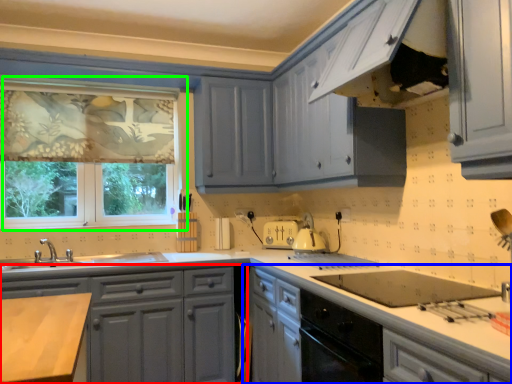
Question: Which object is the closest to the cabinetry (highlighted by a red box)? Choose among these: cabinetry (highlighted by a blue box) or window (highlighted by a green box).

Choices:
 (A) cabinetry
 (B) window

Answer: (A)